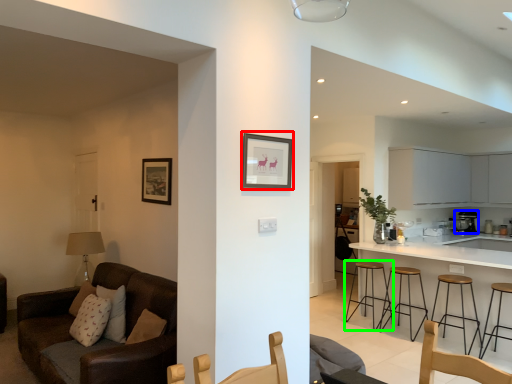
Question: Based on their relative distances, which object is farther from picture frame (highlighted by a red box)? Choose from appliance (highlighted by a blue box) and stool (highlighted by a green box).

Choices:
 (A) appliance
 (B) stool

Answer: (A)